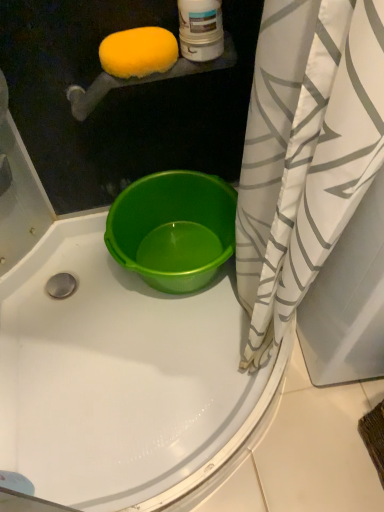
Question: Is white/gray striped shower curtain at right at the back of green plastic bucket at center?

Choices:
 (A) yes
 (B) no

Answer: (B)

Question: Is green plastic bucket at center closer to camera compared to white/gray striped shower curtain at right?

Choices:
 (A) no
 (B) yes

Answer: (A)

Question: From a real-world perspective, is green plastic bucket at center on top of white/gray striped shower curtain at right?

Choices:
 (A) no
 (B) yes

Answer: (A)

Question: Is green plastic bucket at center not near white/gray striped shower curtain at right?

Choices:
 (A) no
 (B) yes

Answer: (A)

Question: Is green plastic bucket at center outside white/gray striped shower curtain at right?

Choices:
 (A) no
 (B) yes

Answer: (B)

Question: Is green plastic bucket at center shorter than white/gray striped shower curtain at right?

Choices:
 (A) yes
 (B) no

Answer: (A)

Question: Is yellow sponge at upper left closer to camera compared to white/gray striped shower curtain at right?

Choices:
 (A) no
 (B) yes

Answer: (A)

Question: From a real-world perspective, is yellow sponge at upper left on white/gray striped shower curtain at right?

Choices:
 (A) yes
 (B) no

Answer: (A)

Question: Does yellow sponge at upper left have a lesser height compared to white/gray striped shower curtain at right?

Choices:
 (A) no
 (B) yes

Answer: (B)

Question: Is yellow sponge at upper left further to the viewer compared to white/gray striped shower curtain at right?

Choices:
 (A) yes
 (B) no

Answer: (A)

Question: Considering the relative sizes of yellow sponge at upper left and white/gray striped shower curtain at right in the image provided, is yellow sponge at upper left smaller than white/gray striped shower curtain at right?

Choices:
 (A) no
 (B) yes

Answer: (B)

Question: From the image's perspective, is yellow sponge at upper left located above white/gray striped shower curtain at right?

Choices:
 (A) yes
 (B) no

Answer: (A)

Question: From a real-world perspective, is yellow sponge at upper left under green plastic bucket at center?

Choices:
 (A) no
 (B) yes

Answer: (A)